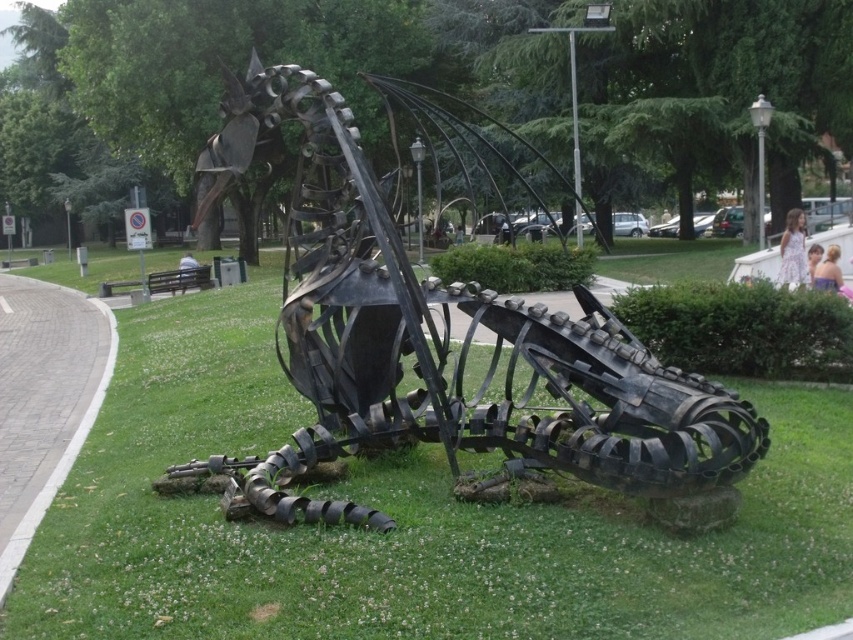
You are planning to place a new bench in the park. The bench requires a space larger than the metallic sculpture at center. Based on the scene, is there enough space on the green grass at center for the bench?

The green grass at center has a larger size compared to the metallic sculpture at center, so there is enough space on the green grass at center for the bench since it is bigger than the metallic sculpture at center.

You are a gardener who needs to mow the green grass at center. Since the metallic sculpture at center is in the way, can you mow the grass without moving the sculpture?

The green grass at center is located below the metallic sculpture at center, so you can mow the grass without moving the sculpture because the grass is underneath it and accessible.